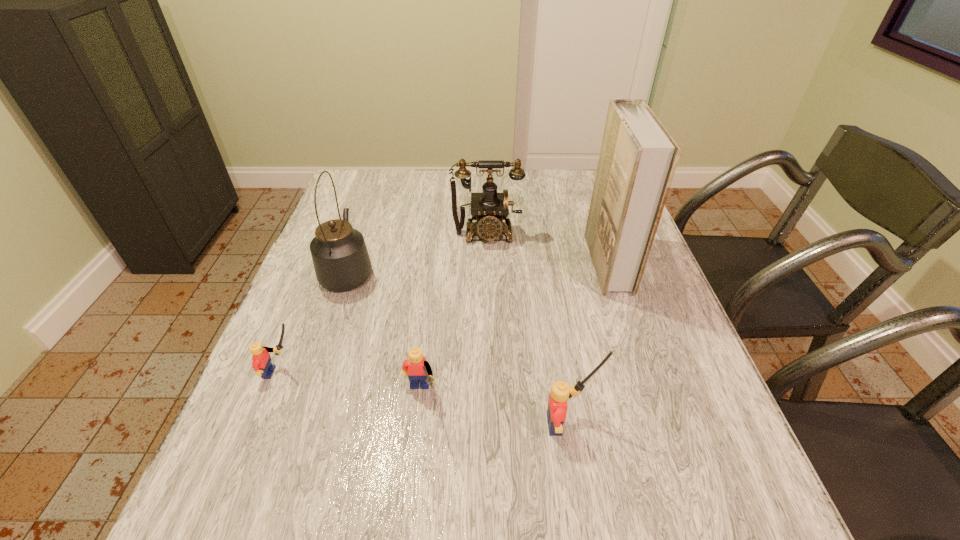
Locate an element on the screen. The image size is (960, 540). free spot between the phonebook and the third object from left to right is located at coordinates (514, 330).

This screenshot has height=540, width=960. I want to click on vacant area between the kettle and the rightmost object, so click(478, 267).

Find the location of `free space between the kettle and the second shortest object`. free space between the kettle and the second shortest object is located at coordinates (384, 334).

Where is `free space between the second Lego from left to right and the rightmost Lego`? free space between the second Lego from left to right and the rightmost Lego is located at coordinates (495, 410).

You are a GUI agent. You are given a task and a screenshot of the screen. Output one action in this format:
    pyautogui.click(x=<x>, y=<y>)
    Task: Click on the vacant space that's between the rightmost object and the second Lego from left to right
    This screenshot has height=540, width=960.
    Given the screenshot: What is the action you would take?
    coord(514,330)

Identify the location of free space between the kettle and the phonebook. Image resolution: width=960 pixels, height=540 pixels. (478, 267).

Where is `blank region between the phonebook and the rightmost Lego`? Image resolution: width=960 pixels, height=540 pixels. blank region between the phonebook and the rightmost Lego is located at coordinates (589, 343).

The image size is (960, 540). Find the location of `free spot between the fourth object from right to left and the phonebook`. free spot between the fourth object from right to left and the phonebook is located at coordinates (514, 330).

This screenshot has width=960, height=540. Find the location of `empty location between the kettle and the second Lego from right to left`. empty location between the kettle and the second Lego from right to left is located at coordinates (384, 334).

Where is `free space between the kettle and the shortest Lego`? Image resolution: width=960 pixels, height=540 pixels. free space between the kettle and the shortest Lego is located at coordinates (315, 322).